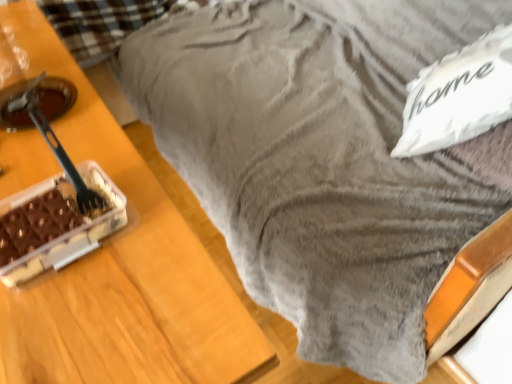
Question: Could you tell me if black plastic fork at left is facing white fluffy pillow at upper right?

Choices:
 (A) no
 (B) yes

Answer: (A)

Question: From a real-world perspective, is black plastic fork at left positioned over white fluffy pillow at upper right based on gravity?

Choices:
 (A) no
 (B) yes

Answer: (B)

Question: Is black plastic fork at left placed right next to white fluffy pillow at upper right?

Choices:
 (A) no
 (B) yes

Answer: (A)

Question: From the image's perspective, is black plastic fork at left on white fluffy pillow at upper right?

Choices:
 (A) no
 (B) yes

Answer: (A)

Question: From the image's perspective, does black plastic fork at left appear lower than white fluffy pillow at upper right?

Choices:
 (A) yes
 (B) no

Answer: (A)

Question: Would you consider black plastic fork at left to be distant from white fluffy pillow at upper right?

Choices:
 (A) yes
 (B) no

Answer: (B)

Question: Can you confirm if black plastic fork at left is bigger than chocolate matte cake at left?

Choices:
 (A) yes
 (B) no

Answer: (B)

Question: Is the position of black plastic fork at left more distant than that of chocolate matte cake at left?

Choices:
 (A) no
 (B) yes

Answer: (B)

Question: Can you confirm if black plastic fork at left is taller than chocolate matte cake at left?

Choices:
 (A) yes
 (B) no

Answer: (A)

Question: Does black plastic fork at left have a lesser width compared to chocolate matte cake at left?

Choices:
 (A) yes
 (B) no

Answer: (A)

Question: From the image's perspective, is black plastic fork at left located above chocolate matte cake at left?

Choices:
 (A) yes
 (B) no

Answer: (A)

Question: From a real-world perspective, does black plastic fork at left stand above chocolate matte cake at left?

Choices:
 (A) yes
 (B) no

Answer: (A)

Question: From the image's perspective, does chocolate matte cake at left appear lower than black plastic fork at left?

Choices:
 (A) yes
 (B) no

Answer: (A)